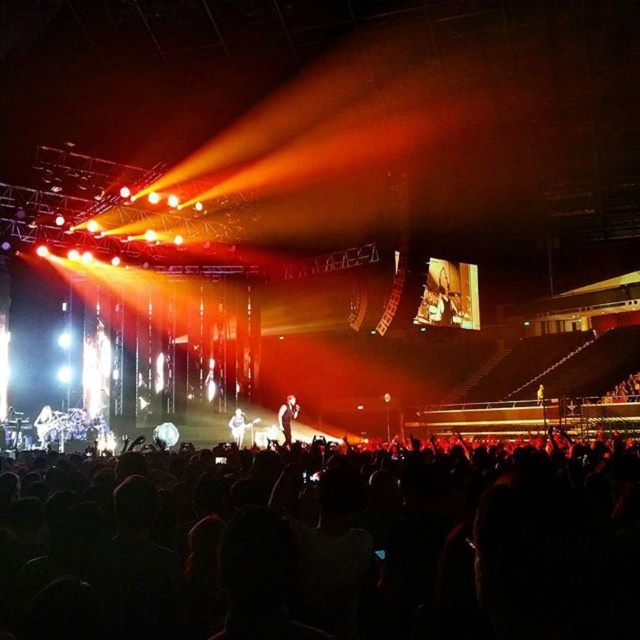
Question: Which point is farther from the camera taking this photo?

Choices:
 (A) (230, 420)
 (B) (445, 560)
 (C) (278, 424)

Answer: (C)

Question: Is black matte crowd at lower center closer to camera compared to white fabric shirt at center?

Choices:
 (A) no
 (B) yes

Answer: (B)

Question: Does white fabric shirt at center have a lesser width compared to yellow fabric person at center?

Choices:
 (A) yes
 (B) no

Answer: (A)

Question: Considering the real-world distances, which object is closest to the white fabric shirt at center?

Choices:
 (A) black leather jacket at center
 (B) yellow fabric person at center

Answer: (A)

Question: Is black matte crowd at lower center to the right of black leather jacket at center from the viewer's perspective?

Choices:
 (A) no
 (B) yes

Answer: (B)

Question: Which point is closer to the camera?

Choices:
 (A) black matte crowd at lower center
 (B) black leather jacket at center

Answer: (A)